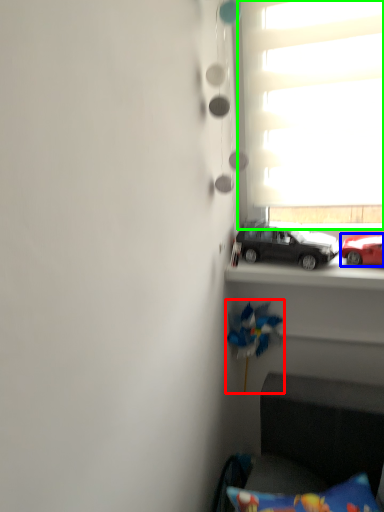
Question: Which object is the closest to the toy (highlighted by a red box)? Choose among these: car (highlighted by a blue box) or window (highlighted by a green box).

Choices:
 (A) car
 (B) window

Answer: (A)